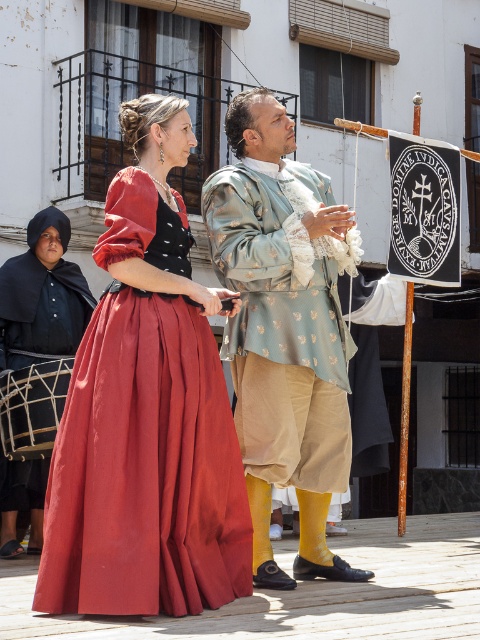
Question: Which object is positioned farthest from the silk dress at center?

Choices:
 (A) silky blue fabric at center
 (B) satin dress at center
 (C) satin black dress at left

Answer: (C)

Question: Does satin dress at center have a lesser width compared to silky blue fabric at center?

Choices:
 (A) no
 (B) yes

Answer: (A)

Question: Which of the following is the closest to the observer?

Choices:
 (A) (215, 260)
 (B) (72, 538)

Answer: (B)

Question: Is satin dress at center thinner than silky blue fabric at center?

Choices:
 (A) no
 (B) yes

Answer: (A)

Question: Which object is the farthest from the satin black dress at left?

Choices:
 (A) silk dress at center
 (B) silky blue fabric at center

Answer: (A)

Question: Does silk dress at center appear under satin dress at center?

Choices:
 (A) yes
 (B) no

Answer: (B)